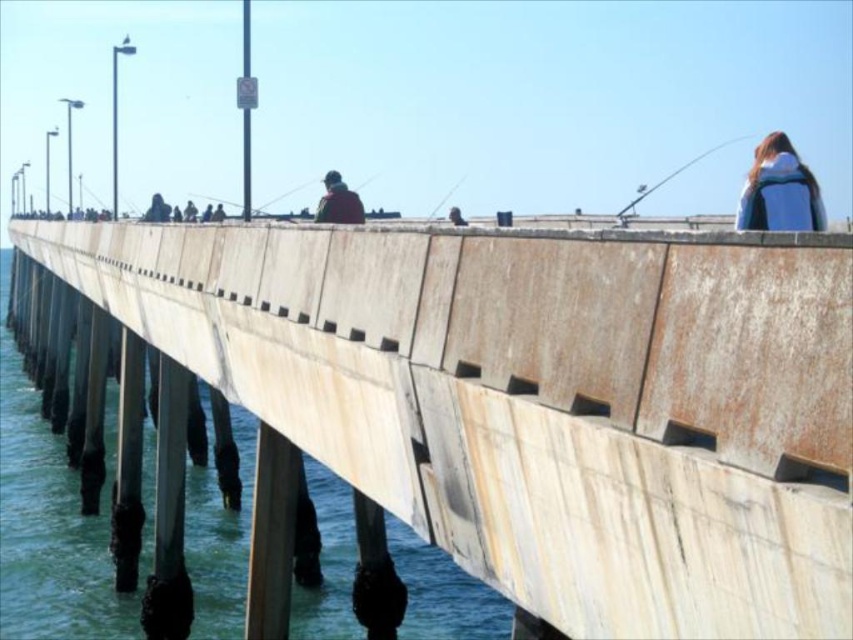
Measure the distance between blue backpack at upper right and matte black fishing pole at upper right.

The distance of blue backpack at upper right from matte black fishing pole at upper right is 582.51 feet.

Which is more to the right, blue backpack at upper right or matte black fishing pole at upper right?

Positioned to the right is matte black fishing pole at upper right.

Locate an element on the screen. blue backpack at upper right is located at coordinates (779, 189).

Who is taller, blue backpack at upper right or reddish-brown leather jacket at center?

With more height is blue backpack at upper right.

Between point (785, 186) and point (334, 212), which one is positioned in front?

Point (785, 186) is more forward.

In order to click on blue backpack at upper right in this screenshot , I will do `click(779, 189)`.

Locate an element on the screen. Image resolution: width=853 pixels, height=640 pixels. blue backpack at upper right is located at coordinates (779, 189).

Is rusty concrete bridge at center in front of matte black fishing pole at upper right?

That is True.

The width and height of the screenshot is (853, 640). What do you see at coordinates (480, 404) in the screenshot? I see `rusty concrete bridge at center` at bounding box center [480, 404].

Where is `rusty concrete bridge at center`? The height and width of the screenshot is (640, 853). rusty concrete bridge at center is located at coordinates (480, 404).